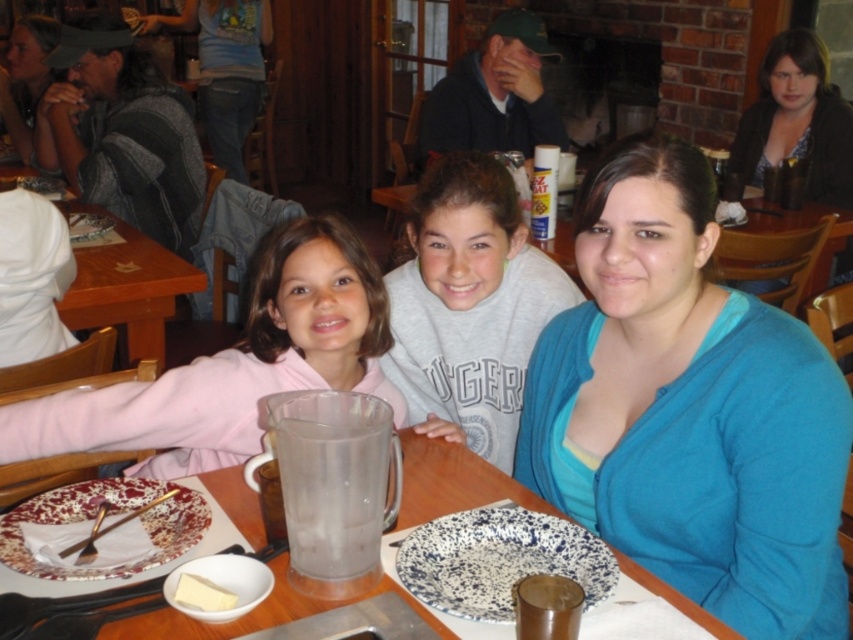
You are standing at the point marked as point (231, 474) in the image. You want to reach the door located 2 meters behind you. If you walk straight backward, will you be able to exit through the door without hitting any obstacles?

The distance between you and the viewer is 1.39 meters. Since the door is 2 meters behind you, you would need to walk 2 meters backward, but you can only move 1.39 meters before reaching the viewer, so you cannot exit through the door without hitting an obstacle.

You are a server at the restaurant and need to refill the clear plastic pitcher at center. You are standing 1 meter away from the table. Can you reach the pitcher without moving closer?

The clear plastic pitcher at center and viewer are 98.79 centimeters apart, so the server can reach the pitcher without moving closer since they are already within the 1 meter distance.